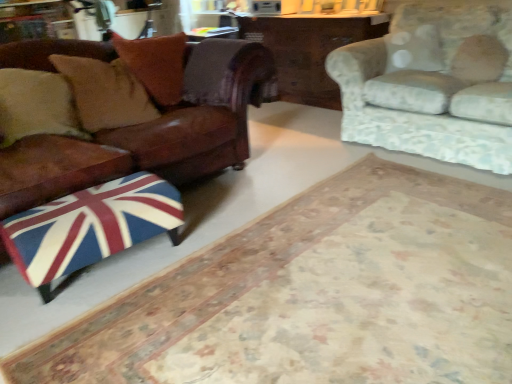
What is the approximate height of union jack fabric ottoman at lower left?

union jack fabric ottoman at lower left is 13.78 inches in height.

Describe the element at coordinates (105, 93) in the screenshot. I see `leather cushion at left, the 1th pillow from the left` at that location.

Consider the image. How much space does leather cushion at left, which appears as the third pillow when viewed from the right, occupy vertically?

leather cushion at left, which appears as the third pillow when viewed from the right, is 20.27 inches tall.

Locate an element on the screen. Image resolution: width=512 pixels, height=384 pixels. floral fabric couch at upper right, which is counted as the 2th studio couch, starting from the left is located at coordinates point(433,84).

From the image's perspective, is union jack fabric ottoman at lower left under leather couch at left, the first studio couch when ordered from left to right?

Yes, from the image's perspective, union jack fabric ottoman at lower left is beneath leather couch at left, the first studio couch when ordered from left to right.

Is union jack fabric ottoman at lower left turned away from leather couch at left, the second studio couch positioned from the right?

No, leather couch at left, the second studio couch positioned from the right, is not at the back of union jack fabric ottoman at lower left.

From the picture: From a real-world perspective, does union jack fabric ottoman at lower left sit lower than leather couch at left, the first studio couch when ordered from left to right?

Yes, from a real-world perspective, union jack fabric ottoman at lower left is under leather couch at left, the first studio couch when ordered from left to right.

Which of these two, union jack fabric ottoman at lower left or fluffy white pillow at upper right, the 1th pillow when ordered from right to left, is smaller?

fluffy white pillow at upper right, the 1th pillow when ordered from right to left, is smaller.

Considering the relative positions of union jack fabric ottoman at lower left and fluffy white pillow at upper right, the 1th pillow when ordered from right to left, in the image provided, is union jack fabric ottoman at lower left to the left or to the right of fluffy white pillow at upper right, the 1th pillow when ordered from right to left,?

union jack fabric ottoman at lower left is positioned on fluffy white pillow at upper right, the 1th pillow when ordered from right to left,'s left side.

Is union jack fabric ottoman at lower left facing towards fluffy white pillow at upper right, which is the 3th pillow in left-to-right order?

No, union jack fabric ottoman at lower left is not turned towards fluffy white pillow at upper right, which is the 3th pillow in left-to-right order.

In the image, is union jack fabric ottoman at lower left positioned in front of or behind fluffy white pillow at upper right, which is the 3th pillow in left-to-right order?

union jack fabric ottoman at lower left is positioned closer to the viewer than fluffy white pillow at upper right, which is the 3th pillow in left-to-right order.

From the image's perspective, between floral fabric couch at upper right, which is counted as the 2th studio couch, starting from the left, and leather couch at left, the second studio couch positioned from the right, which one is located above?

floral fabric couch at upper right, which is counted as the 2th studio couch, starting from the left, from the image's perspective.

Could you measure the distance between floral fabric couch at upper right, which is counted as the 2th studio couch, starting from the left, and leather couch at left, the second studio couch positioned from the right?

floral fabric couch at upper right, which is counted as the 2th studio couch, starting from the left, is 1.19 meters from leather couch at left, the second studio couch positioned from the right.

Considering the relative sizes of floral fabric couch at upper right, which is counted as the 2th studio couch, starting from the left, and leather couch at left, the first studio couch when ordered from left to right, in the image provided, is floral fabric couch at upper right, which is counted as the 2th studio couch, starting from the left, wider than leather couch at left, the first studio couch when ordered from left to right,?

No.

Does floral fabric couch at upper right, the first studio couch when ordered from right to left, have a larger size compared to leather couch at left, the first studio couch when ordered from left to right?

Actually, floral fabric couch at upper right, the first studio couch when ordered from right to left, might be smaller than leather couch at left, the first studio couch when ordered from left to right.

Which is behind, point (155, 200) or point (170, 70)?

The point (170, 70) is behind.

From a real-world perspective, is union jack fabric ottoman at lower left above or below brown leather pillow at upper left, acting as the second pillow starting from the right?

union jack fabric ottoman at lower left is below brown leather pillow at upper left, acting as the second pillow starting from the right.

From the image's perspective, who appears lower, union jack fabric ottoman at lower left or brown leather pillow at upper left, marked as the second pillow in a left-to-right arrangement?

union jack fabric ottoman at lower left appears lower in the image.

From the picture: Can brown leather pillow at upper left, marked as the second pillow in a left-to-right arrangement, be found inside union jack fabric ottoman at lower left?

Actually, brown leather pillow at upper left, marked as the second pillow in a left-to-right arrangement, is outside union jack fabric ottoman at lower left.

From the image's perspective, which one is positioned higher, leather cushion at left, the 1th pillow from the left, or union jack fabric ottoman at lower left?

leather cushion at left, the 1th pillow from the left, appears higher in the image.

How different are the orientations of leather cushion at left, the 1th pillow from the left, and union jack fabric ottoman at lower left in degrees?

The angular difference between leather cushion at left, the 1th pillow from the left, and union jack fabric ottoman at lower left is 0.125 degrees.

Which of these two, leather cushion at left, the 1th pillow from the left, or union jack fabric ottoman at lower left, is bigger?

Bigger between the two is leather cushion at left, the 1th pillow from the left.

From the picture: From a real-world perspective, is leather cushion at left, the 1th pillow from the left, above or below union jack fabric ottoman at lower left?

leather cushion at left, the 1th pillow from the left, is situated higher than union jack fabric ottoman at lower left in the real world.

Which object is positioned more to the right, leather cushion at left, the 1th pillow from the left, or wooden table at center?

wooden table at center is more to the right.

From a real-world perspective, is leather cushion at left, which appears as the third pillow when viewed from the right, beneath wooden table at center?

No, from a real-world perspective, leather cushion at left, which appears as the third pillow when viewed from the right, is not below wooden table at center.

Do you think leather cushion at left, the 1th pillow from the left, is within wooden table at center, or outside of it?

leather cushion at left, the 1th pillow from the left, lies outside wooden table at center.

This screenshot has width=512, height=384. In the image, there is a leather cushion at left, the 1th pillow from the left. Identify the location of table below it (from a real-world perspective). (308, 51).

Between point (186, 79) and point (63, 238), which one is positioned in front?

The point (63, 238) is closer to the camera.

Is leather couch at left, the first studio couch when ordered from left to right, oriented towards union jack fabric ottoman at lower left?

Yes, leather couch at left, the first studio couch when ordered from left to right, is facing union jack fabric ottoman at lower left.

Which object is closer to the camera taking this photo, leather couch at left, the first studio couch when ordered from left to right, or union jack fabric ottoman at lower left?

leather couch at left, the first studio couch when ordered from left to right, is more forward.

Which of these two, leather couch at left, the first studio couch when ordered from left to right, or union jack fabric ottoman at lower left, stands taller?

leather couch at left, the first studio couch when ordered from left to right, is taller.

In the image, there is a leather couch at left, the second studio couch positioned from the right. Where is `mat below it (from a real-world perspective)`? This screenshot has width=512, height=384. mat below it (from a real-world perspective) is located at coordinates (238, 274).

I want to click on mat to the left of fluffy white pillow at upper right, which is the 3th pillow in left-to-right order, so click(238, 274).

Estimate the real-world distances between objects in this image. Which object is further from floral fabric couch at upper right, which is counted as the 2th studio couch, starting from the left, brown leather pillow at upper left, marked as the second pillow in a left-to-right arrangement, or union jack fabric ottoman at lower left?

union jack fabric ottoman at lower left lies further to floral fabric couch at upper right, which is counted as the 2th studio couch, starting from the left, than the other object.

When comparing their distances from union jack fabric ottoman at lower left, does fluffy white pillow at upper right, the 1th pillow when ordered from right to left, or union jack fabric ottoman at lower left seem further?

Based on the image, fluffy white pillow at upper right, the 1th pillow when ordered from right to left, appears to be further to union jack fabric ottoman at lower left.

Looking at the image, which one is located closer to leather cushion at left, the 1th pillow from the left, fluffy white pillow at upper right, the 1th pillow when ordered from right to left, or floral fabric couch at upper right, the first studio couch when ordered from right to left?

Among the two, floral fabric couch at upper right, the first studio couch when ordered from right to left, is located nearer to leather cushion at left, the 1th pillow from the left.

When comparing their distances from union jack fabric ottoman at lower left, does leather cushion at left, which appears as the third pillow when viewed from the right, or union jack fabric ottoman at lower left seem closer?

Based on the image, union jack fabric ottoman at lower left appears to be nearer to union jack fabric ottoman at lower left.

From the image, which object appears to be nearer to brown leather pillow at upper left, acting as the second pillow starting from the right, wooden table at center or union jack fabric ottoman at lower left?

Among the two, union jack fabric ottoman at lower left is located nearer to brown leather pillow at upper left, acting as the second pillow starting from the right.

Estimate the real-world distances between objects in this image. Which object is further from wooden table at center, fluffy white pillow at upper right, which is the 3th pillow in left-to-right order, or union jack fabric ottoman at lower left?

The object further to wooden table at center is union jack fabric ottoman at lower left.

When comparing their distances from floral fabric couch at upper right, the first studio couch when ordered from right to left, does brown leather pillow at upper left, acting as the second pillow starting from the right, or leather cushion at left, the 1th pillow from the left, seem further?

leather cushion at left, the 1th pillow from the left, is further to floral fabric couch at upper right, the first studio couch when ordered from right to left.

Looking at the image, which one is located further to floral fabric couch at upper right, which is counted as the 2th studio couch, starting from the left, fluffy white pillow at upper right, which is the 3th pillow in left-to-right order, or union jack fabric ottoman at lower left?

Based on the image, union jack fabric ottoman at lower left appears to be further to floral fabric couch at upper right, which is counted as the 2th studio couch, starting from the left.

Locate an element on the screen. The height and width of the screenshot is (384, 512). flag located between leather couch at left, the second studio couch positioned from the right, and floral fabric couch at upper right, which is counted as the 2th studio couch, starting from the left, in the left-right direction is located at coordinates (90, 226).

Locate an element on the screen. The image size is (512, 384). mat situated between leather couch at left, the second studio couch positioned from the right, and floral fabric couch at upper right, which is counted as the 2th studio couch, starting from the left, from left to right is located at coordinates (238, 274).

Locate an element on the screen. Image resolution: width=512 pixels, height=384 pixels. pillow between union jack fabric ottoman at lower left and brown leather pillow at upper left, acting as the second pillow starting from the right, from front to back is located at coordinates (105, 93).

At what (x,y) coordinates should I click in order to perform the action: click on table between leather cushion at left, the 1th pillow from the left, and fluffy white pillow at upper right, which is the 3th pillow in left-to-right order. Please return your answer as a coordinate pair (x, y). Looking at the image, I should click on (308, 51).